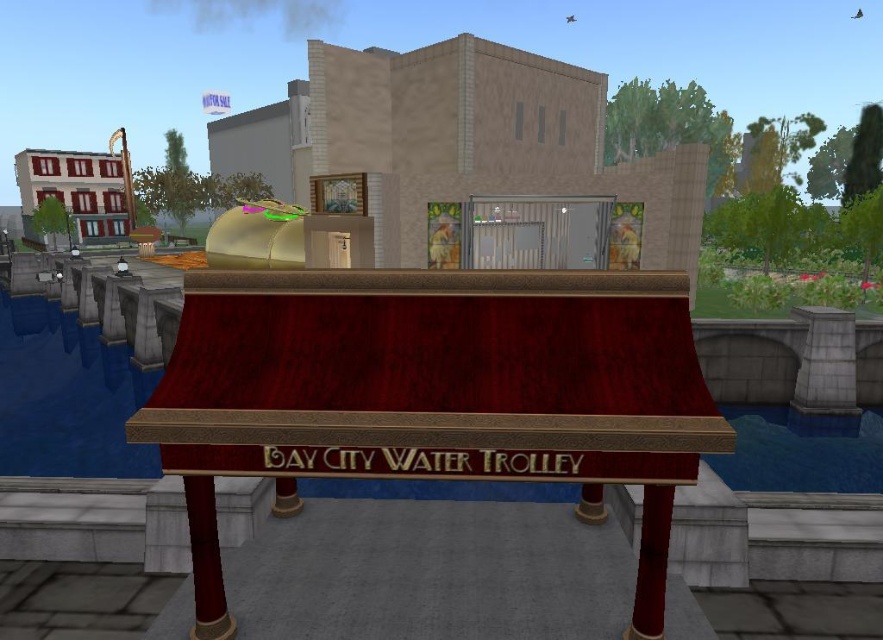
Question: Which point is farther to the camera?

Choices:
 (A) (12, 456)
 (B) (206, 532)
 (C) (801, 484)

Answer: (A)

Question: Does blue water at lower left appear over shiny red wood pillar at lower right?

Choices:
 (A) yes
 (B) no

Answer: (A)

Question: Which object appears farthest from the camera in this image?

Choices:
 (A) blue water at lower left
 (B) smooth red wood pillar at lower center
 (C) gray stone pillar at right

Answer: (C)

Question: Which object appears farthest from the camera in this image?

Choices:
 (A) gray stone pillar at right
 (B) smooth red wood pillar at lower center
 (C) blue water at lower right

Answer: (A)

Question: Is blue water at lower left closer to the viewer compared to smooth red wood pillar at lower center?

Choices:
 (A) no
 (B) yes

Answer: (A)

Question: Can you confirm if gray stone pillar at right is wider than smooth red wood pillar at lower center?

Choices:
 (A) yes
 (B) no

Answer: (A)